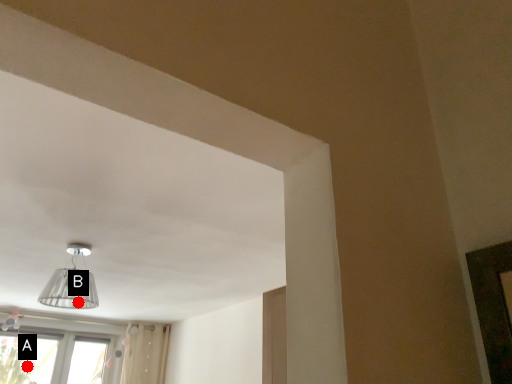
Question: Two points are circled on the image, labeled by A and B beside each circle. Which point appears farthest from the camera in this image?

Choices:
 (A) A is further
 (B) B is further

Answer: (A)